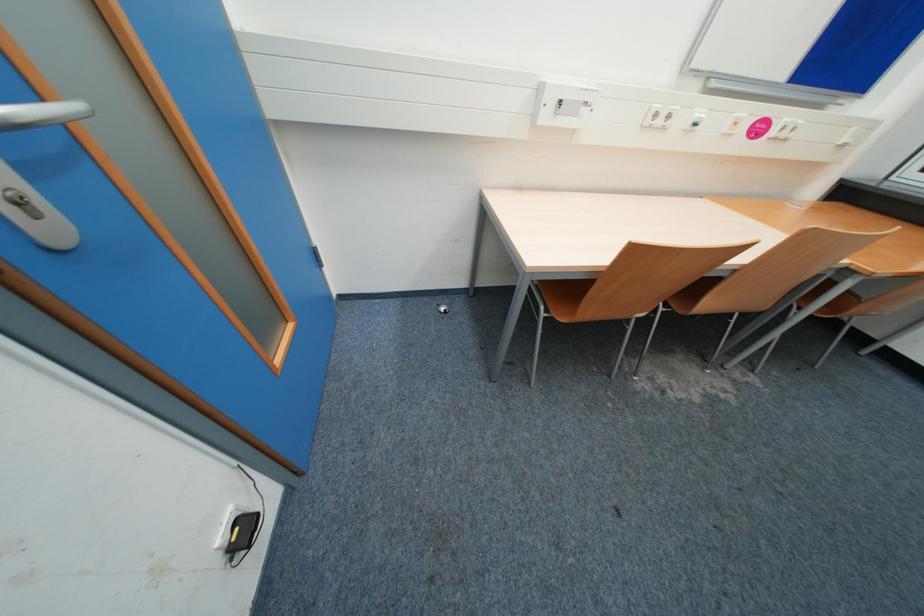
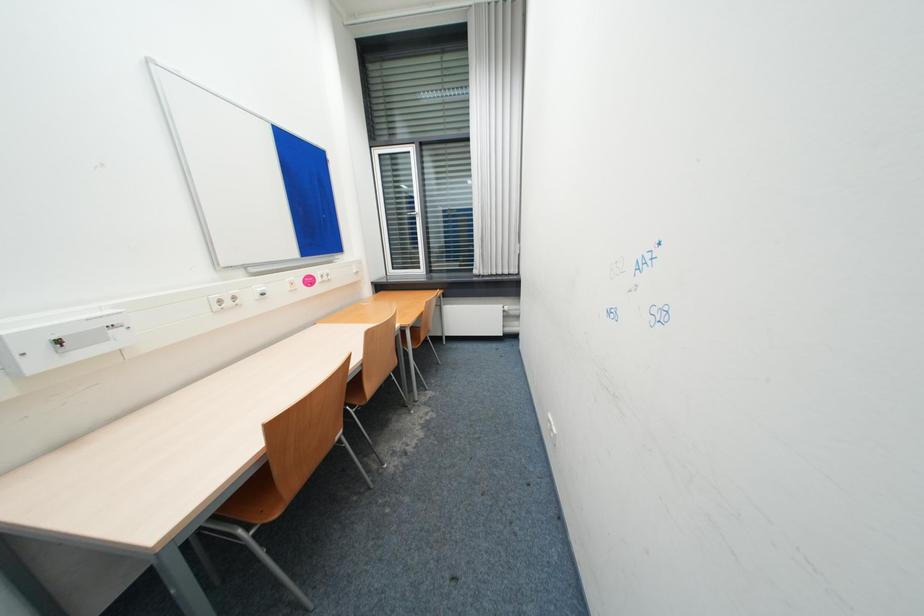
Question: Based on the continuous images, in which direction is the camera rotating? Reply with the corresponding letter.

Choices:
 (A) Left
 (B) Right
 (C) Up
 (D) Down

Answer: (B)